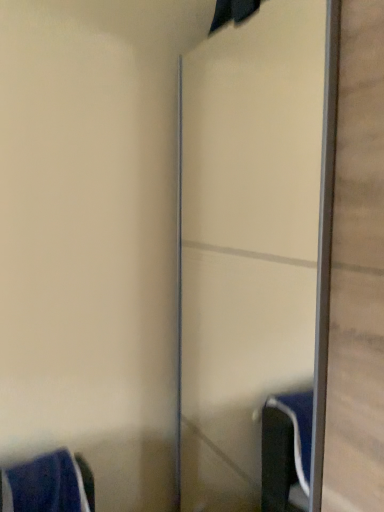
Identify the location of white glossy screen door at center. This screenshot has height=512, width=384. (247, 241).

What do you see at coordinates (247, 241) in the screenshot? The width and height of the screenshot is (384, 512). I see `white glossy screen door at center` at bounding box center [247, 241].

Where is `white glossy screen door at center`? Image resolution: width=384 pixels, height=512 pixels. white glossy screen door at center is located at coordinates (247, 241).